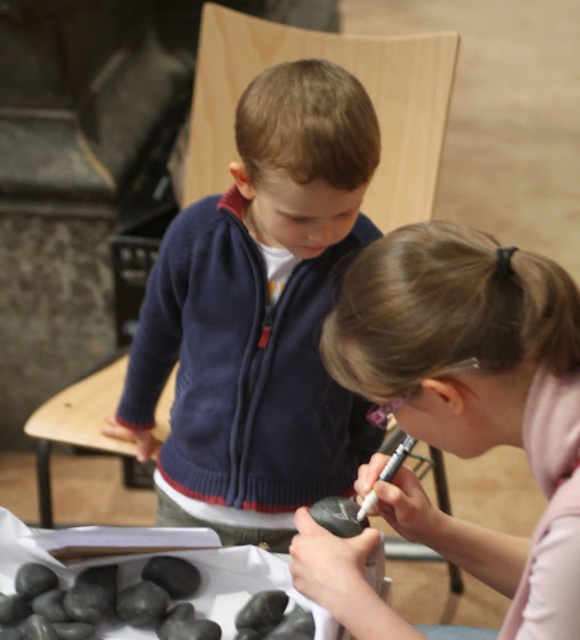
You are an observer in the room where the navy fleece sweater at center and the smooth black rock at center are present. Which object is positioned higher in the image?

The navy fleece sweater at center is positioned higher than the smooth black rock at center.